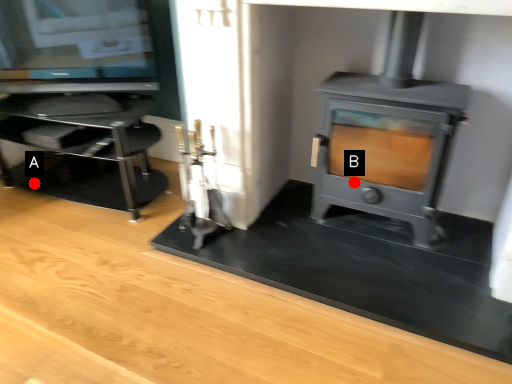
Question: Two points are circled on the image, labeled by A and B beside each circle. Which point appears farthest from the camera in this image?

Choices:
 (A) A is further
 (B) B is further

Answer: (A)